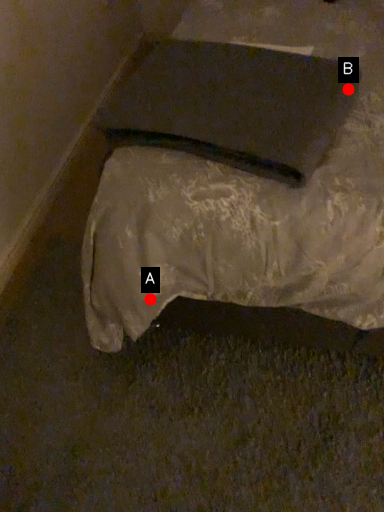
Question: Two points are circled on the image, labeled by A and B beside each circle. Which point is farther from the camera taking this photo?

Choices:
 (A) A is further
 (B) B is further

Answer: (A)